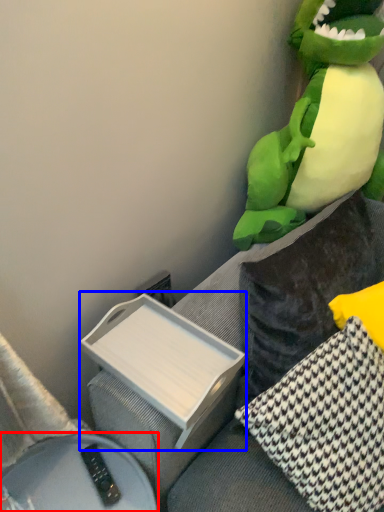
Question: Which object appears closest to the camera in this image, furniture (highlighted by a red box) or box (highlighted by a blue box)?

Choices:
 (A) furniture
 (B) box

Answer: (A)